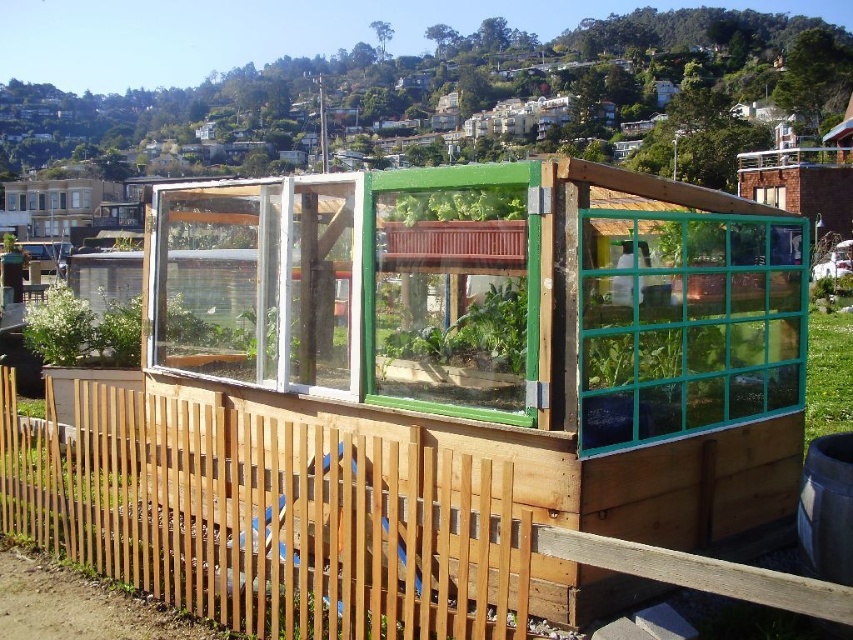
Does brown wooden fence at center lie behind green plastic window at center?

No.

What do you see at coordinates (265, 518) in the screenshot?
I see `brown wooden fence at center` at bounding box center [265, 518].

Locate an element on the screen. This screenshot has height=640, width=853. brown wooden fence at center is located at coordinates (265, 518).

Which is more to the left, green plastic window at center or green leafy plant at left?

From the viewer's perspective, green leafy plant at left appears more on the left side.

Is the position of green plastic window at center more distant than that of green leafy plant at left?

No, green plastic window at center is closer to the viewer.

Is point (479, 234) in front of point (70, 305)?

Yes, it is.

Locate an element on the screen. This screenshot has height=640, width=853. green plastic window at center is located at coordinates (450, 296).

From the picture: Can you confirm if brown wooden fence at center is bigger than teal glass window at center right?

Yes.

Is the position of brown wooden fence at center less distant than that of teal glass window at center right?

That is True.

Who is more distant from viewer, (6, 525) or (651, 305)?

Point (6, 525)

Where is `brown wooden fence at center`? brown wooden fence at center is located at coordinates (265, 518).